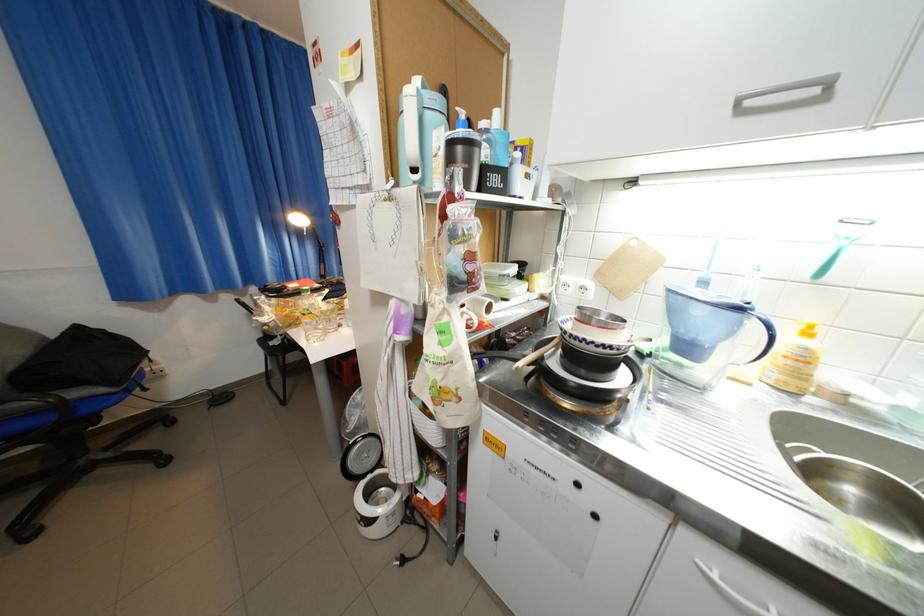
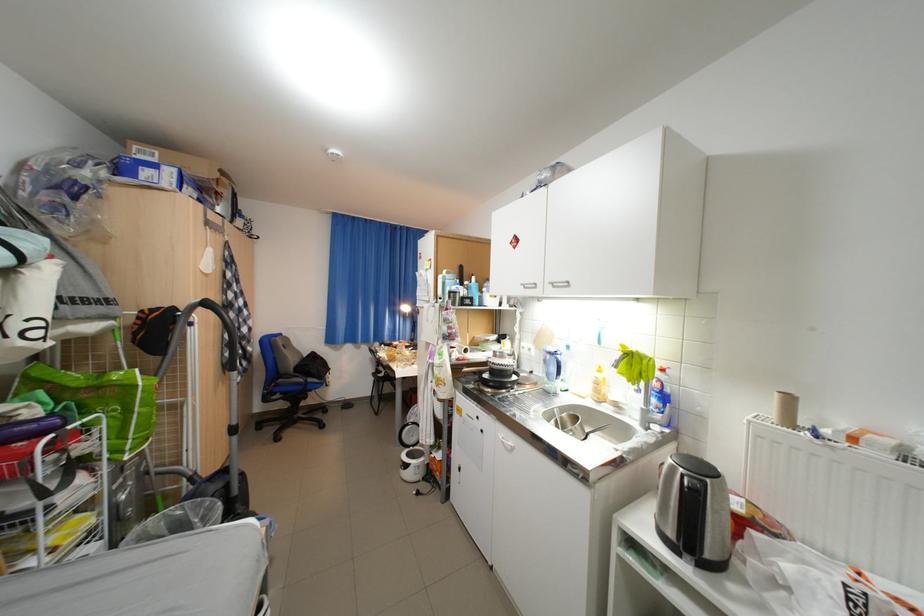
Question: I am providing you with two images of the same scene from different viewpoints. Which of the following objects are not visible in image2?

Choices:
 (A) vacuum cleaner handle
 (B) kettle handle
 (C) black chair armrest
 (D) none of these

Answer: (D)